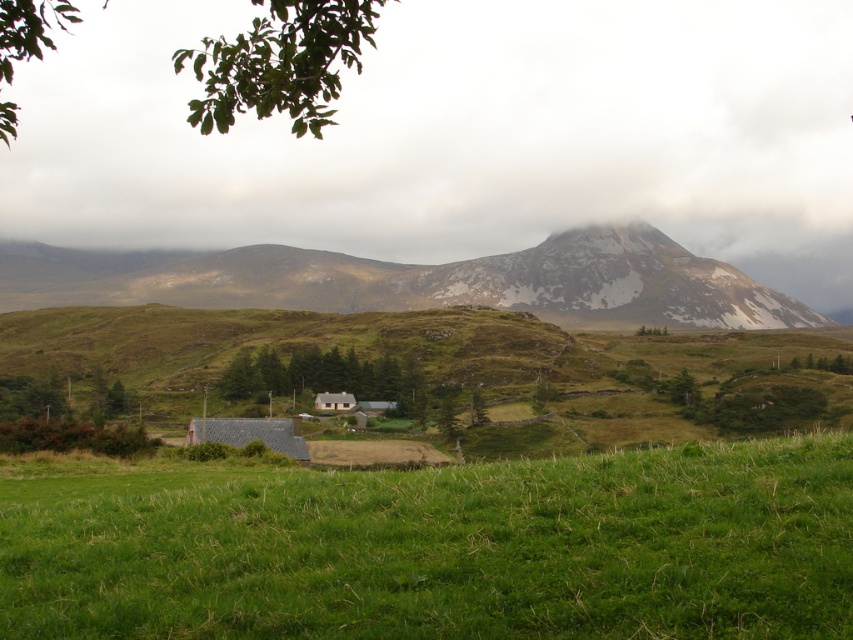
Can you confirm if green grassy field at center is positioned above wooden cabin at center?

Yes.

In the scene shown: Can you confirm if green grassy field at center is thinner than wooden cabin at center?

No.

Between point (722, 616) and point (329, 408), which one is positioned in front?

Positioned in front is point (722, 616).

The height and width of the screenshot is (640, 853). Find the location of `green grassy field at center`. green grassy field at center is located at coordinates (437, 547).

Between green grassy field at center and rugged stone mountain at upper center, which one is positioned higher?

rugged stone mountain at upper center is higher up.

The height and width of the screenshot is (640, 853). What do you see at coordinates (437, 547) in the screenshot? I see `green grassy field at center` at bounding box center [437, 547].

Who is more forward, (491, 490) or (572, 308)?

Point (491, 490) is more forward.

This screenshot has height=640, width=853. What are the coordinates of `green grassy field at center` in the screenshot? It's located at click(x=437, y=547).

Is rugged stone mountain at upper center smaller than wooden cabin at center?

Incorrect, rugged stone mountain at upper center is not smaller in size than wooden cabin at center.

Between point (236, 300) and point (322, 410), which one is positioned behind?

Positioned behind is point (236, 300).

Which is behind, point (630, 305) or point (317, 394)?

Positioned behind is point (630, 305).

The height and width of the screenshot is (640, 853). Identify the location of rugged stone mountain at upper center. (419, 282).